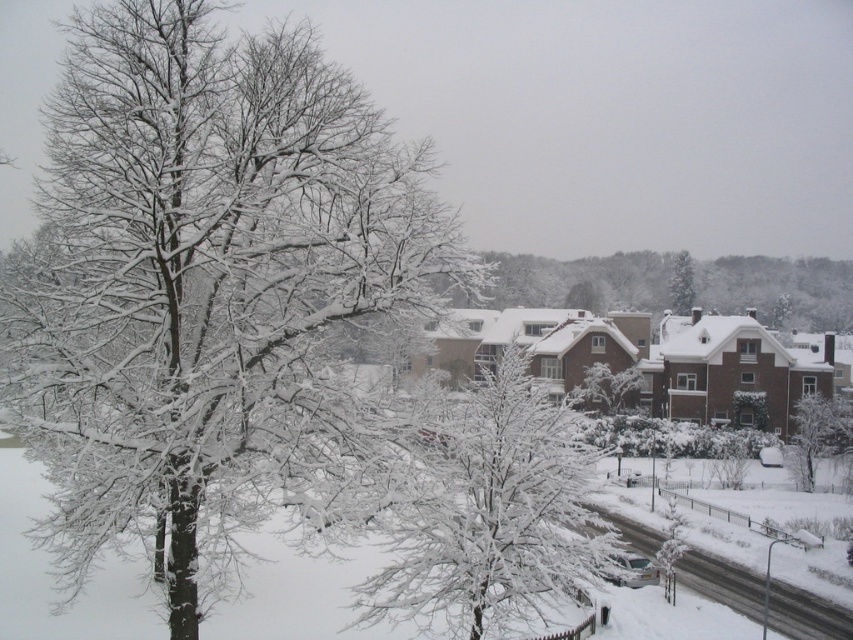
Question: Is white snow-covered tree at center to the right of green matte tree at upper center from the viewer's perspective?

Choices:
 (A) yes
 (B) no

Answer: (B)

Question: Which object is closer to the camera taking this photo?

Choices:
 (A) snow-covered tree at center
 (B) green matte tree at upper center

Answer: (A)

Question: Which of the following is the farthest from the observer?

Choices:
 (A) snow-covered tree at left
 (B) green matte tree at upper center
 (C) white snow-covered tree at center

Answer: (B)

Question: Is snow-covered tree at left below green matte tree at upper center?

Choices:
 (A) no
 (B) yes

Answer: (A)

Question: Is snow-covered tree at left positioned behind snow-covered tree at center?

Choices:
 (A) no
 (B) yes

Answer: (A)

Question: Among these points, which one is nearest to the camera?

Choices:
 (A) (674, 310)
 (B) (259, 349)
 (C) (821, 424)

Answer: (B)